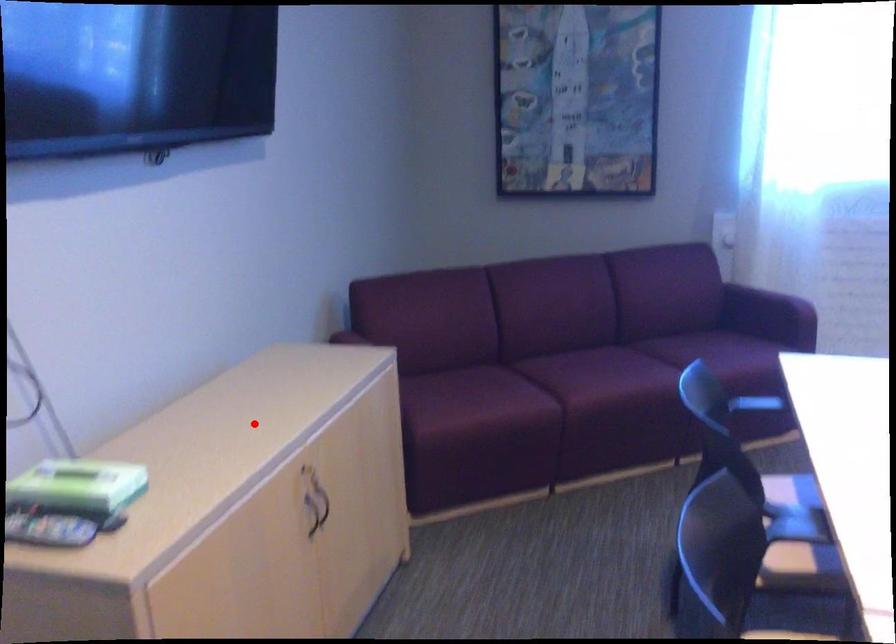
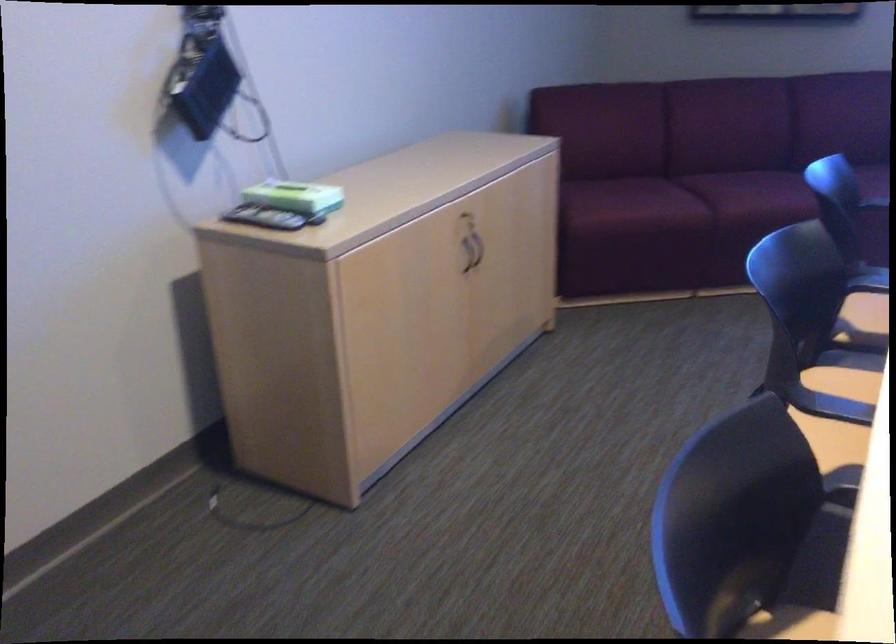
Find the pixel in the second image that matches the highlighted location in the first image.

(428, 175)